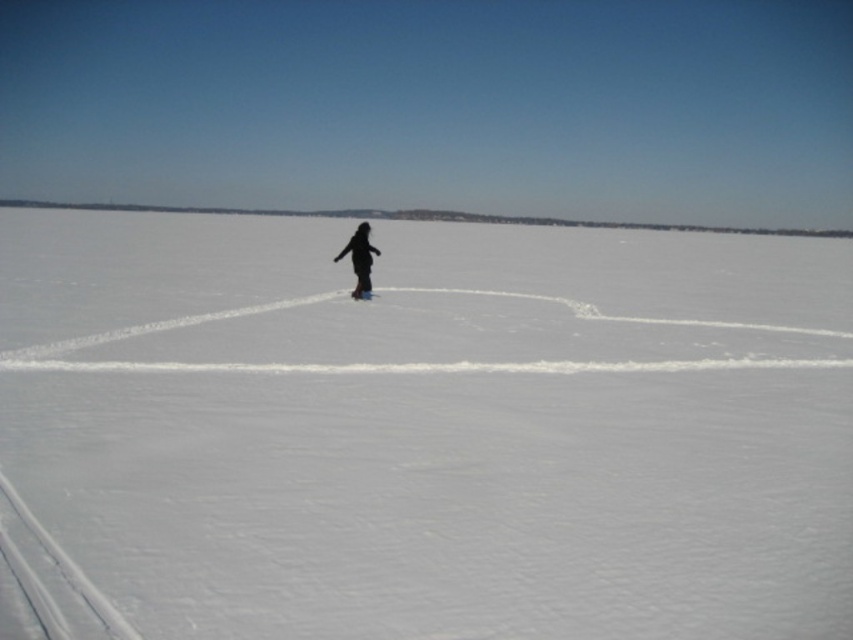
You are a photographer trying to capture the perfect shot of the person walking in the snow. The camera is set up at point A. You want to ensure that the white smooth snow at center is in focus while keeping the distant hills in the background. Where should you adjust the focus point to achieve this?

The white smooth snow at center is located at point (x=421, y=432), so you should adjust the focus point to that coordinate to ensure it is sharp while the distant hills remain in the background.

Based on the photo, you are planning to take a photo of the black matte snowboarder at center and the white matte snowboard at center in the snowy landscape. If you want to ensure both objects are fully visible in the frame, which object should you focus on first considering their widths?

The black matte snowboarder at center might be wider than the white matte snowboard at center, so focusing on the black matte snowboarder at center first would ensure both are fully visible.

You are standing at the edge of a snowy field and see the white smooth snow at center and the black matte snowboarder at center. Which object is closer to you?

The white smooth snow at center is closer to the viewer than the black matte snowboarder at center.